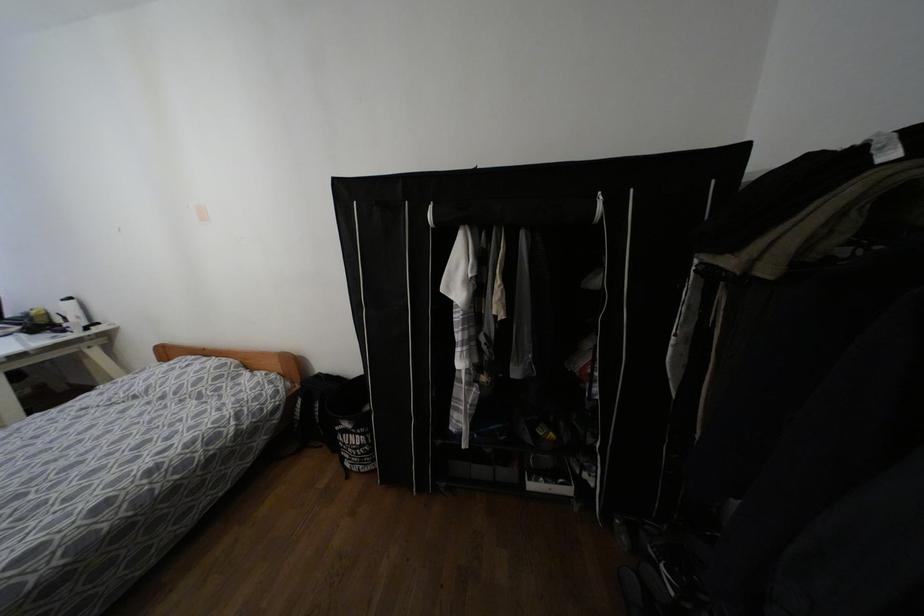
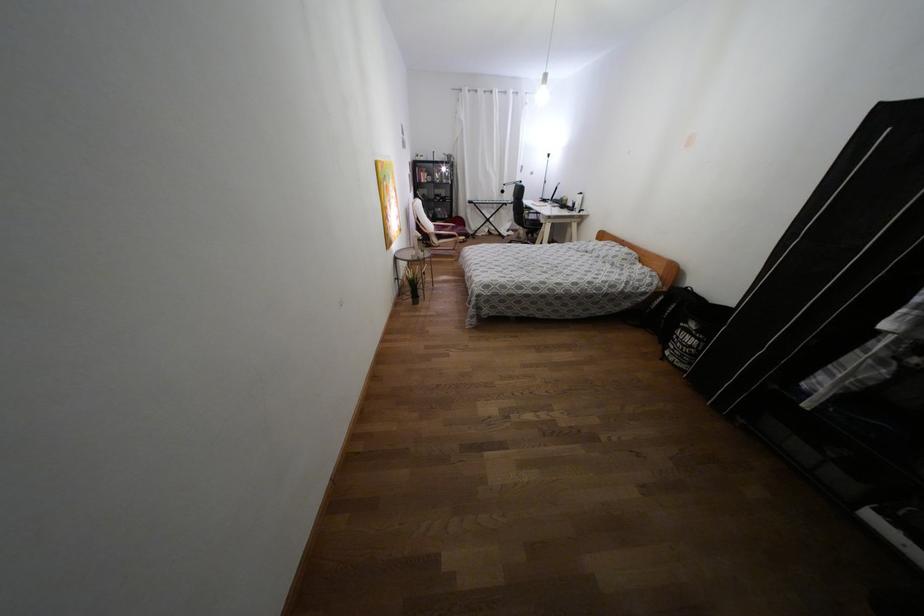
In the second image, find the point that corresponds to (x=344, y=444) in the first image.

(676, 337)